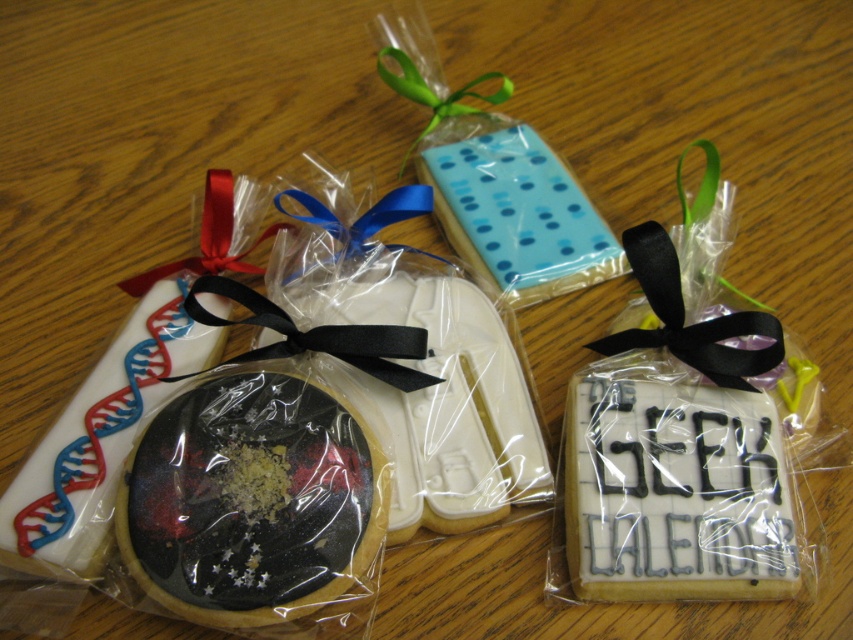
You are a baker trying to place a red satin ribbon at center on top of the glittery galaxy cookie at center. Based on the image, will the ribbon fit entirely on the cookie without overhanging?

The glittery galaxy cookie at center might be wider than red satin ribbon at center, so there is a possibility that the ribbon will fit, but the exact dimensions are uncertain. Check the actual sizes before placing.